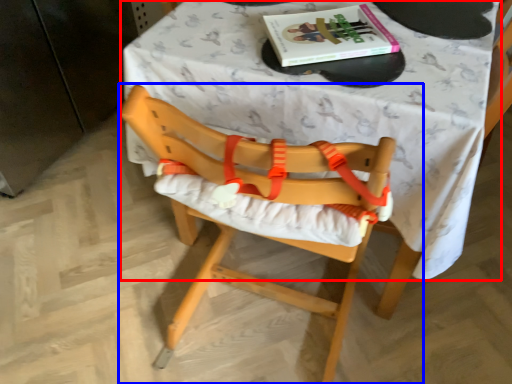
Question: Which point is closer to the camera, table (highlighted by a red box) or chair (highlighted by a blue box)?

Choices:
 (A) table
 (B) chair

Answer: (B)